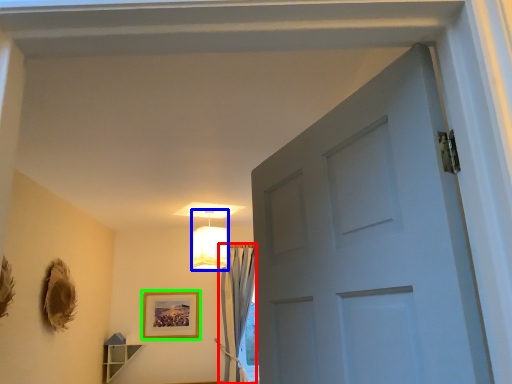
Question: Considering the real-world distances, which object is closest to curtain (highlighted by a red box)? lamp (highlighted by a blue box) or picture frame (highlighted by a green box).

Choices:
 (A) lamp
 (B) picture frame

Answer: (B)